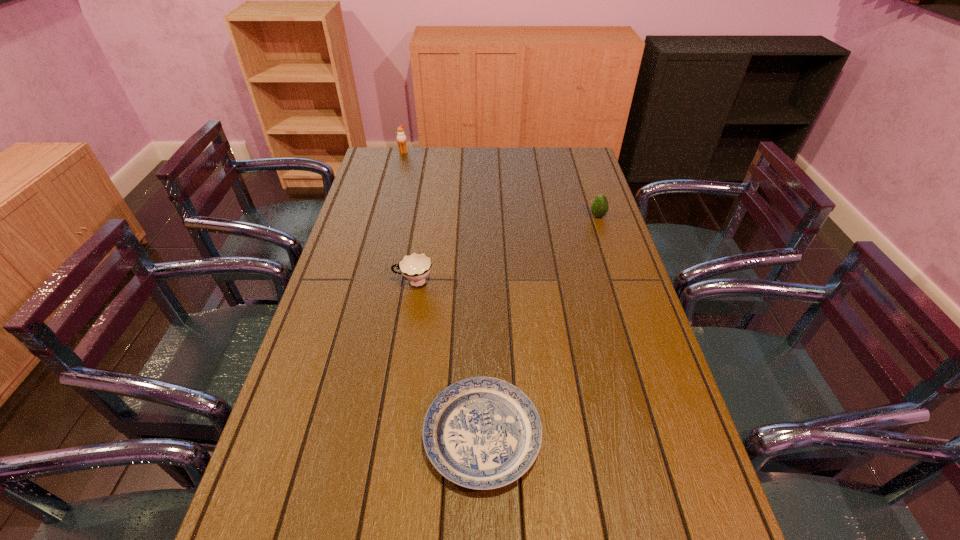
This screenshot has width=960, height=540. In the image, there is a desktop. What are the coordinates of `vacant region at the right edge` in the screenshot? It's located at (624, 372).

You are a GUI agent. You are given a task and a screenshot of the screen. Output one action in this format:
    pyautogui.click(x=<x>, y=<y>)
    Task: Click on the vacant space that is in between the icecream and the nearest object
    
    Given the screenshot: What is the action you would take?
    pyautogui.click(x=443, y=294)

This screenshot has height=540, width=960. Identify the location of vacant area that lies between the shortest object and the icecream. (443, 294).

In order to click on free space that is in between the icecream and the second object from left to right in this screenshot , I will do `click(409, 218)`.

The height and width of the screenshot is (540, 960). I want to click on free point between the tallest object and the third object from left to right, so click(x=443, y=294).

Locate an element on the screen. Image resolution: width=960 pixels, height=540 pixels. free space between the farthest object and the second object from left to right is located at coordinates 409,218.

The width and height of the screenshot is (960, 540). What are the coordinates of `vacant area that lies between the farthest object and the rightmost object` in the screenshot? It's located at tap(501, 184).

Locate an element on the screen. The height and width of the screenshot is (540, 960). blank region between the leftmost object and the avocado is located at coordinates (501, 184).

Locate an element on the screen. free area in between the nearest object and the third farthest object is located at coordinates (448, 359).

Identify the location of vacant space that is in between the cup and the avocado. The height and width of the screenshot is (540, 960). (506, 249).